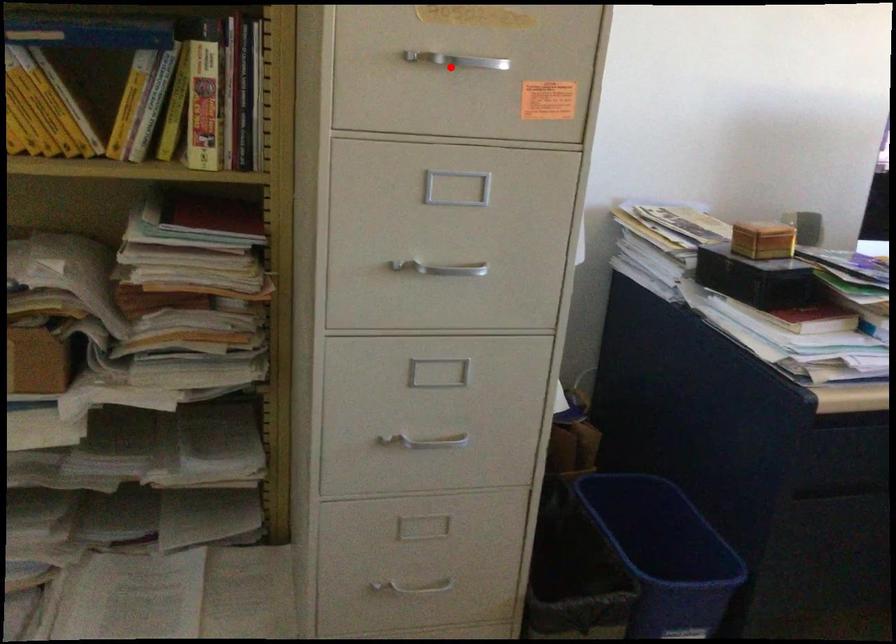
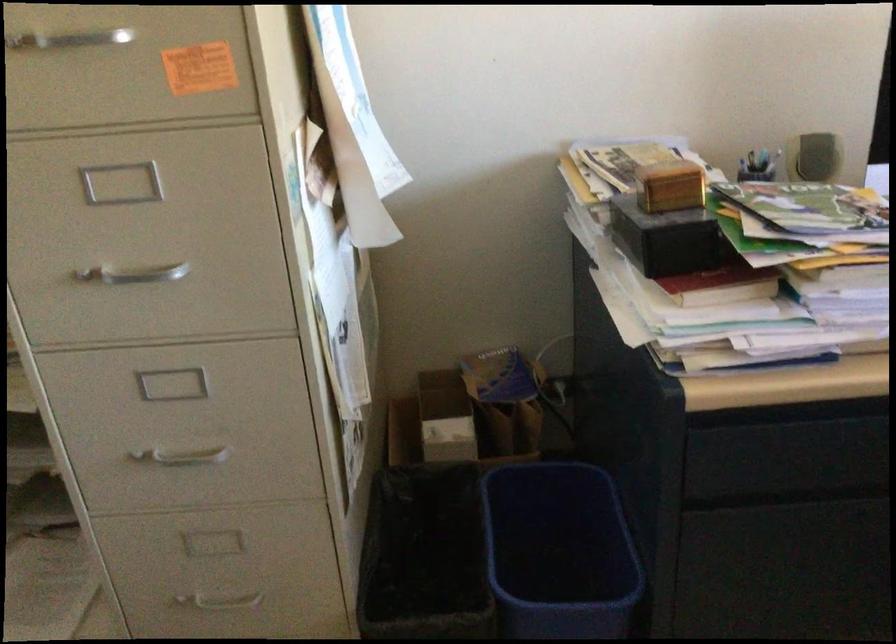
Find the pixel in the second image that matches the highlighted location in the first image.

(67, 40)